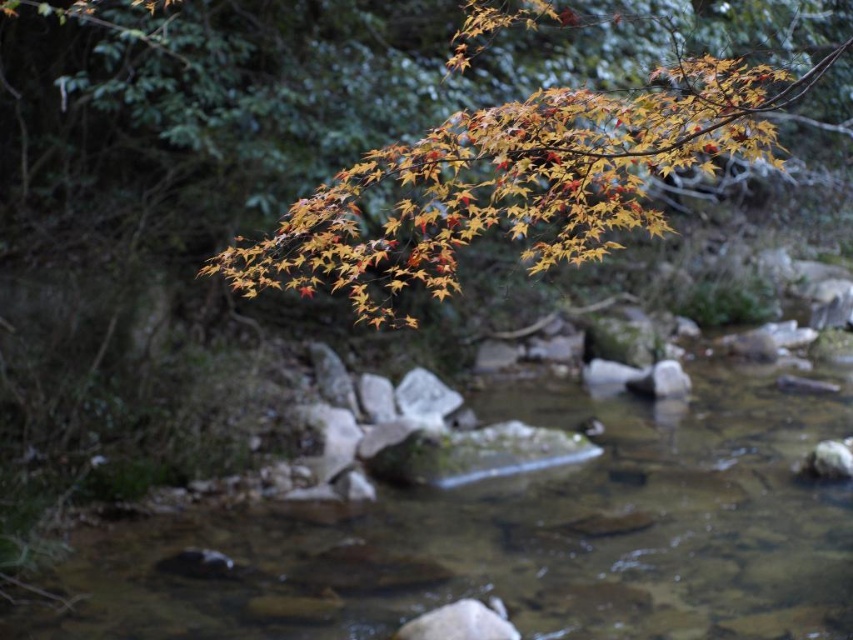
You are a photographer aiming to capture the point at coordinates point (376, 513) and point (520, 211) in the same frame. Based on the scene, which point is farther away from the camera?

Point (376, 513) is behind point (520, 211), so it is farther away from the camera.